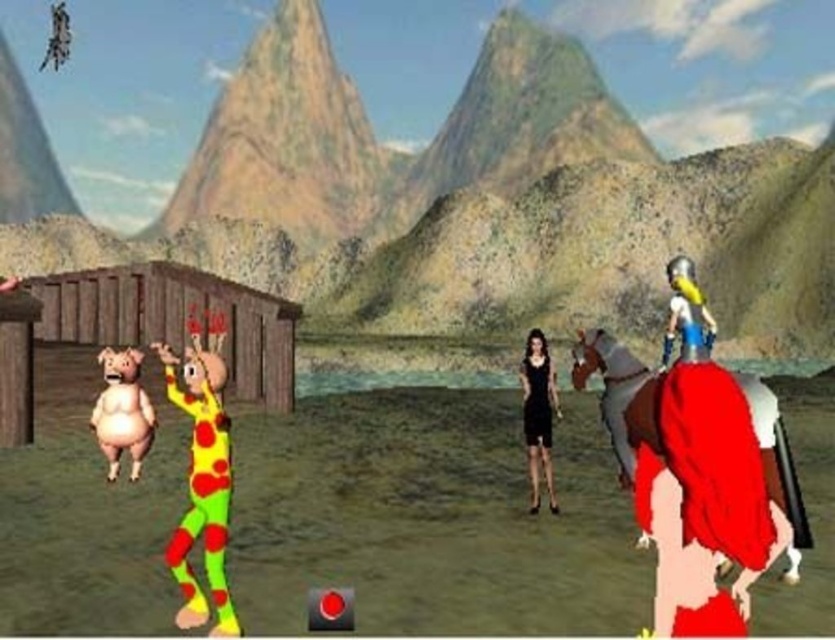
Is shiny red cape at right smaller than pink rubber pig at left?

Incorrect, shiny red cape at right is not smaller in size than pink rubber pig at left.

Who is positioned more to the left, shiny red cape at right or pink rubber pig at left?

pink rubber pig at left is more to the left.

This screenshot has width=835, height=640. Describe the element at coordinates (611, 387) in the screenshot. I see `shiny red cape at right` at that location.

What are the coordinates of `shiny red cape at right` in the screenshot? It's located at (611, 387).

Which is more to the right, shiny red cape at right or black satin dress at center?

shiny red cape at right

Does shiny red cape at right appear over black satin dress at center?

Yes.

Who is more distant from viewer, (610, 420) or (545, 349)?

Point (545, 349)

Where is `shiny red cape at right`? shiny red cape at right is located at coordinates (611, 387).

Does pink rubber pig at left appear under black satin dress at center?

Incorrect, pink rubber pig at left is not positioned below black satin dress at center.

Can you confirm if pink rubber pig at left is positioned to the right of black satin dress at center?

Incorrect, pink rubber pig at left is not on the right side of black satin dress at center.

Describe the element at coordinates (122, 410) in the screenshot. The width and height of the screenshot is (835, 640). I see `pink rubber pig at left` at that location.

Where is `pink rubber pig at left`? pink rubber pig at left is located at coordinates (122, 410).